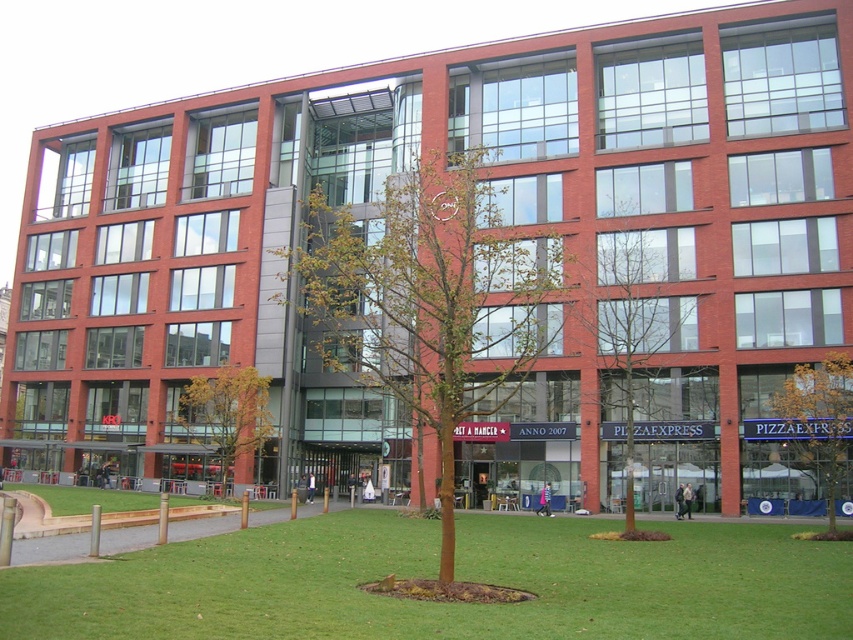
How much distance is there between green grass at center and yellow-green leaves at center?

They are 18.78 meters apart.

Based on the photo, does green grass at center appear on the right side of yellow-green leaves at center?

Correct, you'll find green grass at center to the right of yellow-green leaves at center.

Find the location of a particular element. The image size is (853, 640). green grass at center is located at coordinates (457, 579).

The width and height of the screenshot is (853, 640). I want to click on green grass at center, so click(x=457, y=579).

Which is below, green leafy tree at center or green leafy tree at lower right?

green leafy tree at lower right is below.

Which of these two, green leafy tree at center or green leafy tree at lower right, stands shorter?

green leafy tree at lower right is shorter.

Where is `green leafy tree at center`? green leafy tree at center is located at coordinates (431, 301).

Locate an element on the screen. This screenshot has width=853, height=640. green leafy tree at center is located at coordinates (431, 301).

Between green grass at center and green leafy tree at center, which one appears on the right side from the viewer's perspective?

green grass at center is more to the right.

Is point (254, 593) farther from camera compared to point (422, 449)?

No, (254, 593) is in front of (422, 449).

Between point (264, 612) and point (415, 321), which one is positioned in front?

Positioned in front is point (264, 612).

Where is `green grass at center`? This screenshot has width=853, height=640. green grass at center is located at coordinates (457, 579).